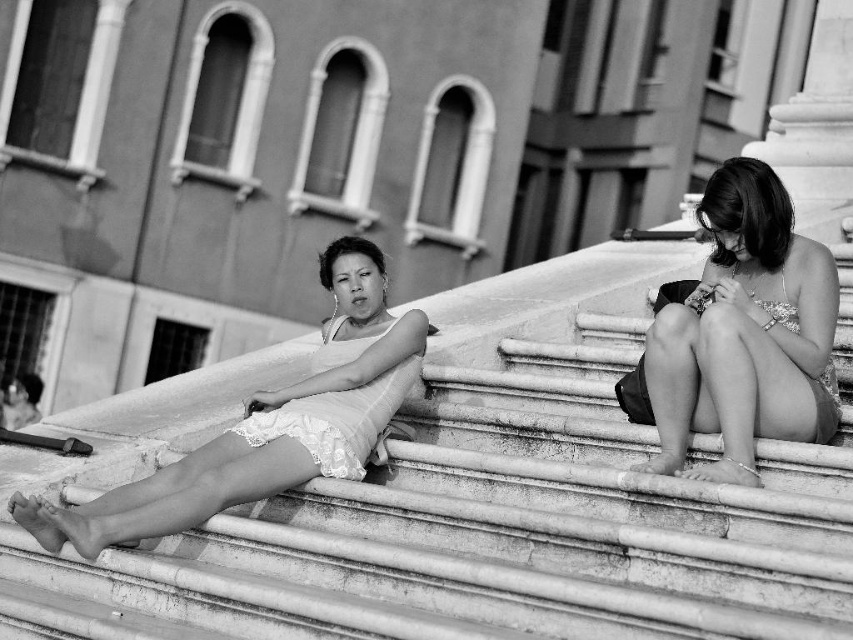
Which of these two, smooth stone stairs at center or matte silver dress at right, stands shorter?

matte silver dress at right is shorter.

Does point (601, 496) lie behind point (738, 186)?

No.

Is point (637, 524) positioned behind point (728, 428)?

No, it is in front of (728, 428).

This screenshot has width=853, height=640. I want to click on smooth stone stairs at center, so (x=485, y=531).

Is smooth stone stairs at center positioned before lace fabric dress at center?

Yes.

Is smooth stone stairs at center taller than lace fabric dress at center?

Yes.

This screenshot has height=640, width=853. Describe the element at coordinates (485, 531) in the screenshot. I see `smooth stone stairs at center` at that location.

The image size is (853, 640). I want to click on smooth stone stairs at center, so click(485, 531).

Between matte silver dress at right and lace fabric dress at center, which one appears on the right side from the viewer's perspective?

Positioned to the right is matte silver dress at right.

Which of these two, matte silver dress at right or lace fabric dress at center, stands shorter?

With less height is matte silver dress at right.

Which is behind, point (635, 388) or point (68, 529)?

The point (635, 388) is more distant.

Locate an element on the screen. matte silver dress at right is located at coordinates (741, 336).